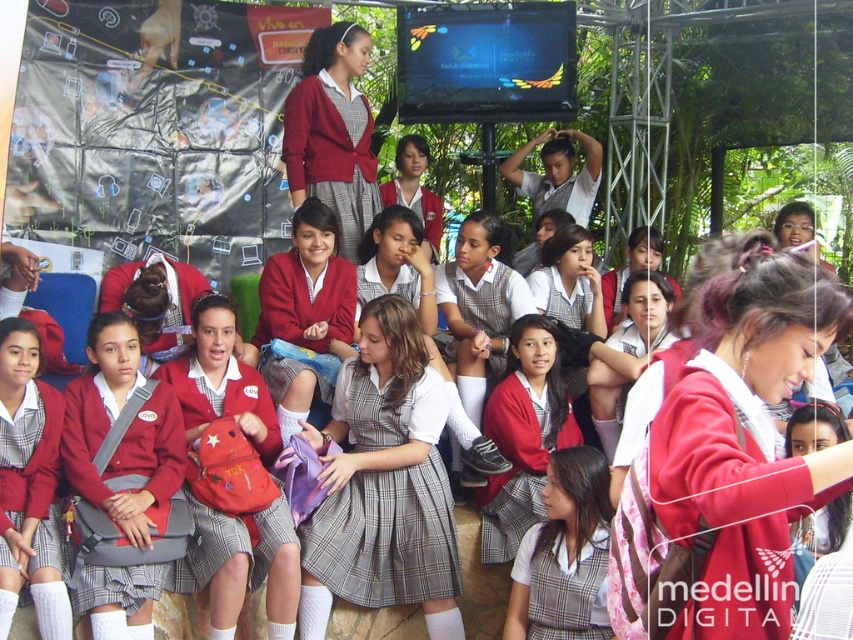
You are standing in the garden where the schoolgirls are seated. You need to find the plaid cotton dress at center. Based on the coordinates provided, can you determine its position relative to the stone tiles and the large screen?

The plaid cotton dress at center is located at coordinates point (386, 538), which places it closer to the large screen mounted on the metal frame structure behind the group rather than the stone tiles on the ground.

You are standing in front of the large screen at the back of the image. You want to walk towards the point that is closer to you. Which point should you walk towards, point (x=434, y=547) or point (x=538, y=586)?

Point (x=538, y=586) is closer to you than point (x=434, y=547), so you should walk towards point (x=538, y=586).

You are a photographer taking a picture of the plaid cotton dress at center and the plaid fabric skirt at center. Which one will be visible in the foreground of your photo?

The plaid cotton dress at center is located above the plaid fabric skirt at center, so the plaid cotton dress at center will be visible in the foreground of your photo.